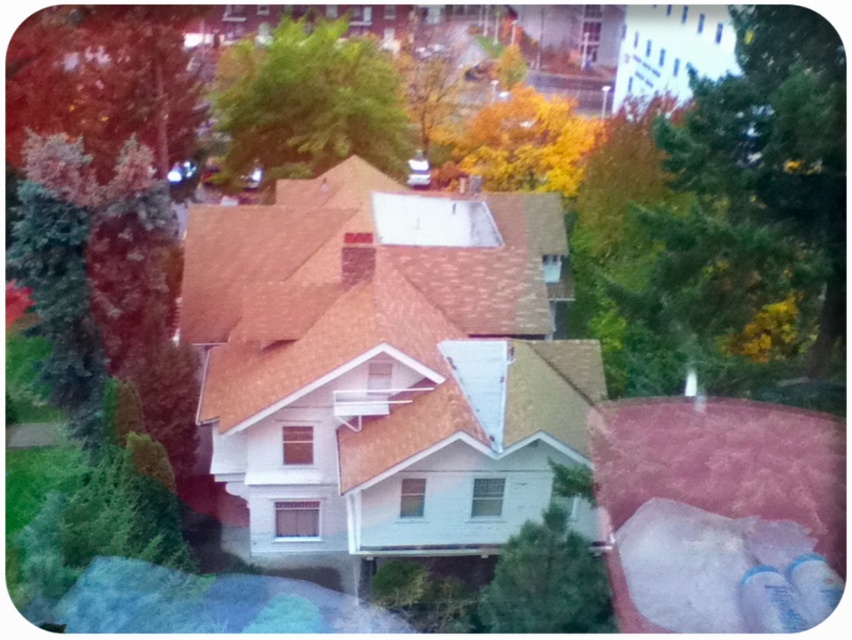
Is green leafy tree at upper center wider than yellow autumn leaves at upper center?

Yes, green leafy tree at upper center is wider than yellow autumn leaves at upper center.

At what (x,y) coordinates should I click in order to perform the action: click on green leafy tree at upper center. Please return your answer as a coordinate pair (x, y). The image size is (852, 640). Looking at the image, I should click on click(308, 102).

The image size is (852, 640). Identify the location of green leafy tree at upper center. (308, 102).

Between point (125, 116) and point (488, 173), which one is positioned behind?

The point (488, 173) is more distant.

Can you confirm if smooth red bark tree at upper left is thinner than yellow autumn leaves at upper center?

Correct, smooth red bark tree at upper left's width is less than yellow autumn leaves at upper center's.

Which is in front, point (104, 157) or point (559, 131)?

Point (104, 157) is more forward.

Locate an element on the screen. This screenshot has height=640, width=852. smooth red bark tree at upper left is located at coordinates (104, 77).

Does smooth red bark tree at upper left have a lesser width compared to green leafy tree at upper center?

Correct, smooth red bark tree at upper left's width is less than green leafy tree at upper center's.

Which is in front, point (85, 104) or point (223, 134)?

Point (85, 104)

Between point (194, 92) and point (298, 74), which one is positioned in front?

Point (298, 74) is more forward.

The image size is (852, 640). I want to click on smooth red bark tree at upper left, so click(x=104, y=77).